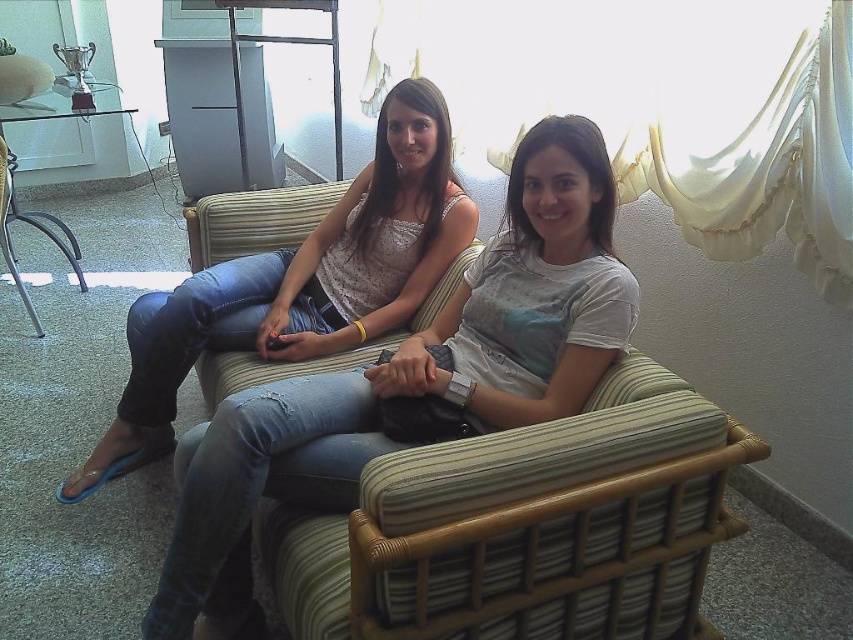
Question: Which point is farther to the camera?

Choices:
 (A) matte white tank top at center
 (B) denim jeans at center

Answer: (A)

Question: Where is denim jeans at center located in relation to matte white tank top at center in the image?

Choices:
 (A) left
 (B) right

Answer: (B)

Question: Where is denim jeans at center located in relation to matte white tank top at center in the image?

Choices:
 (A) left
 (B) right

Answer: (B)

Question: In this image, where is denim jeans at center located relative to matte white tank top at center?

Choices:
 (A) below
 (B) above

Answer: (A)